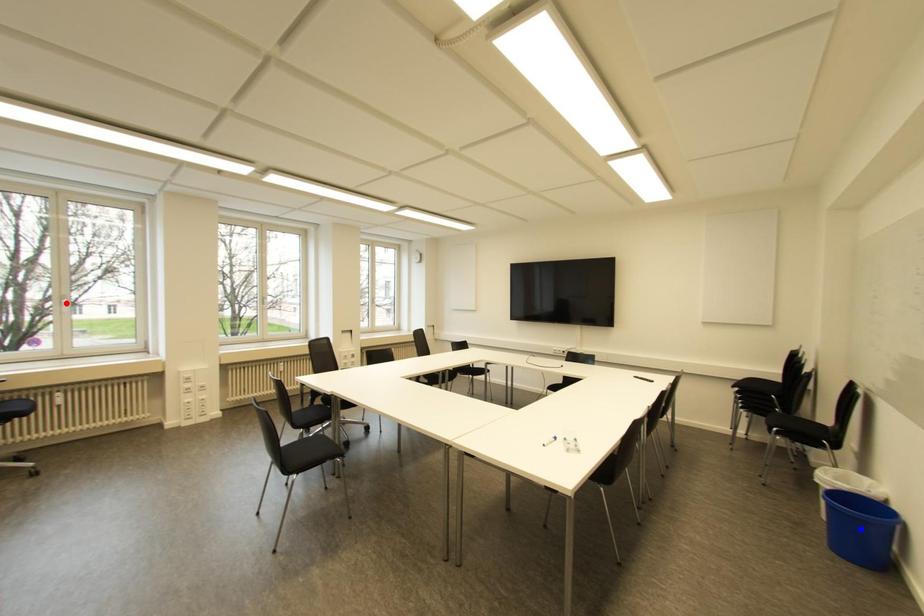
Question: Two points are marked on the image. Which point is closer to the camera?

Choices:
 (A) Blue point is closer.
 (B) Red point is closer.

Answer: (A)